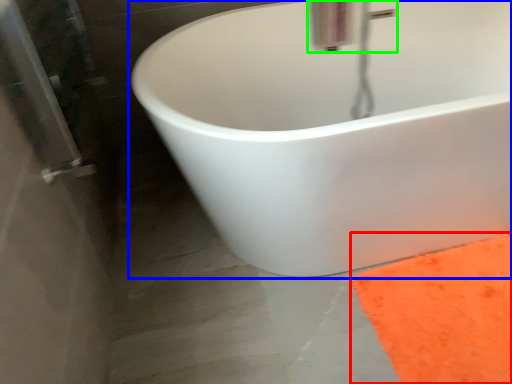
Question: Estimate the real-world distances between objects in this image. Which object is closer to doormat (highlighted by a red box), bathtub (highlighted by a blue box) or plumbing fixture (highlighted by a green box)?

Choices:
 (A) bathtub
 (B) plumbing fixture

Answer: (A)